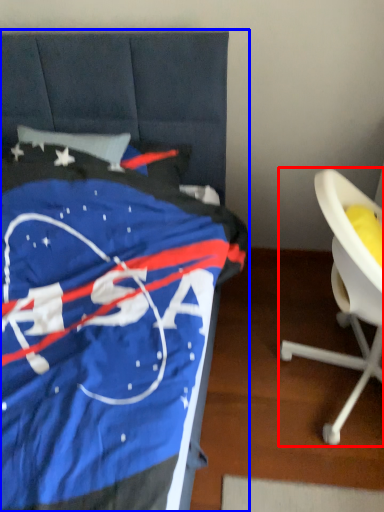
Question: Which of the following is the farthest to the observer, chair (highlighted by a red box) or furniture (highlighted by a blue box)?

Choices:
 (A) chair
 (B) furniture

Answer: (A)